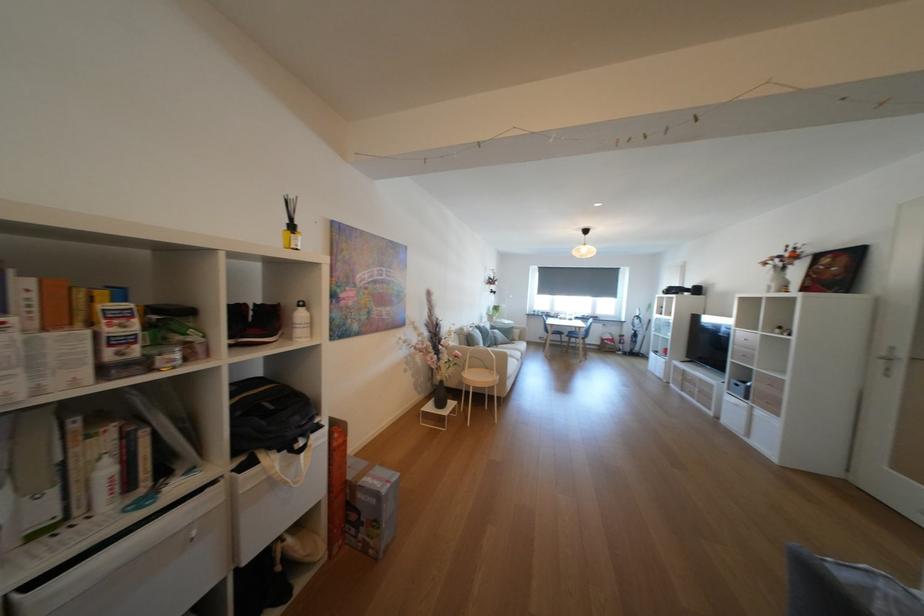
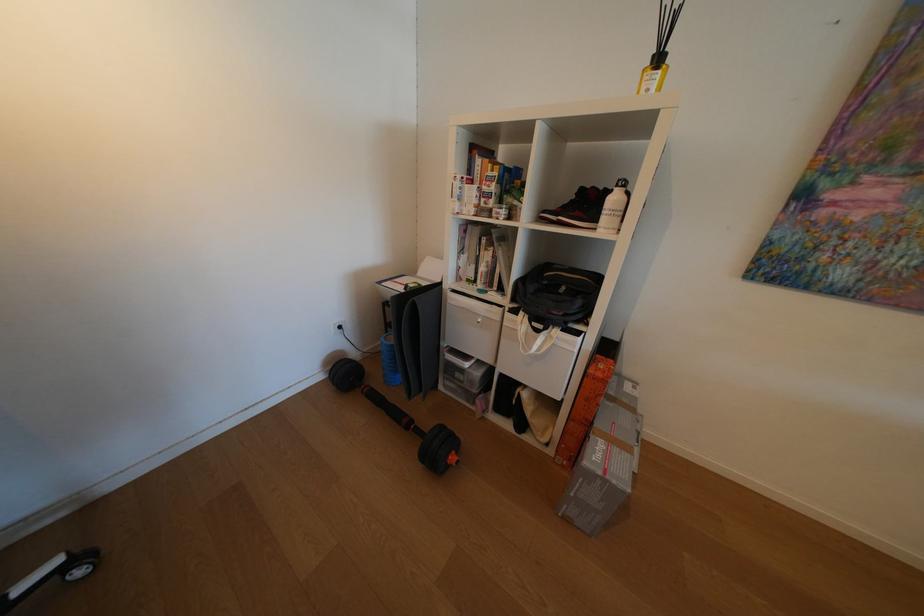
Locate, in the second image, the point that corresponds to point (351, 442) in the first image.

(611, 376)